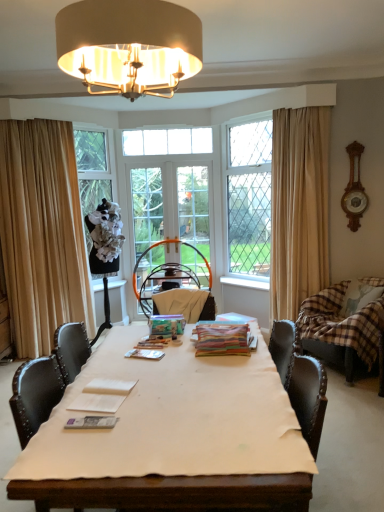
Question: Is there a large distance between metallic silver magazine at center, which is the second magazine from left to right, and clear glass window at center, the first window viewed from the right?

Choices:
 (A) yes
 (B) no

Answer: (A)

Question: Would you say metallic silver magazine at center, the second magazine from the bottom, contains clear glass window at center, acting as the 2th window starting from the left?

Choices:
 (A) no
 (B) yes

Answer: (A)

Question: Does metallic silver magazine at center, the 2th magazine when ordered from back to front, have a greater height compared to clear glass window at center, the 2th window positioned from the back?

Choices:
 (A) yes
 (B) no

Answer: (B)

Question: Is metallic silver magazine at center, the second magazine when ordered from right to left, touching clear glass window at center, the 2th window positioned from the back?

Choices:
 (A) yes
 (B) no

Answer: (B)

Question: Does metallic silver magazine at center, the second magazine when ordered from right to left, come behind clear glass window at center, which is counted as the first window, starting from the front?

Choices:
 (A) yes
 (B) no

Answer: (B)

Question: From the image's perspective, relative to brown plaid fabric swivel chair at right, is beige fabric curtain at left, acting as the first curtain starting from the left, above or below?

Choices:
 (A) below
 (B) above

Answer: (B)

Question: From a real-world perspective, is beige fabric curtain at left, acting as the first curtain starting from the left, physically located above or below brown plaid fabric swivel chair at right?

Choices:
 (A) above
 (B) below

Answer: (A)

Question: Is point (81, 309) positioned closer to the camera than point (339, 291)?

Choices:
 (A) closer
 (B) farther

Answer: (B)

Question: Based on their sizes in the image, would you say beige fabric curtain at left, acting as the first curtain starting from the left, is bigger or smaller than brown plaid fabric swivel chair at right?

Choices:
 (A) big
 (B) small

Answer: (A)

Question: Considering the positions of brown plaid fabric swivel chair at right and clear glass screen door at center, which ranks as the 1th screen door in right-to-left order, in the image, is brown plaid fabric swivel chair at right taller or shorter than clear glass screen door at center, which ranks as the 1th screen door in right-to-left order,?

Choices:
 (A) short
 (B) tall

Answer: (A)

Question: Considering the positions of brown plaid fabric swivel chair at right and clear glass screen door at center, positioned as the 2th screen door in left-to-right order, in the image, is brown plaid fabric swivel chair at right wider or thinner than clear glass screen door at center, positioned as the 2th screen door in left-to-right order,?

Choices:
 (A) wide
 (B) thin

Answer: (A)

Question: Is brown plaid fabric swivel chair at right situated inside clear glass screen door at center, positioned as the 2th screen door in left-to-right order, or outside?

Choices:
 (A) outside
 (B) inside

Answer: (A)

Question: Considering the positions of brown plaid fabric swivel chair at right and clear glass screen door at center, which ranks as the 1th screen door in right-to-left order, in the image, is brown plaid fabric swivel chair at right bigger or smaller than clear glass screen door at center, which ranks as the 1th screen door in right-to-left order,?

Choices:
 (A) small
 (B) big

Answer: (B)

Question: Is point (349, 295) closer or farther from the camera than point (188, 136)?

Choices:
 (A) closer
 (B) farther

Answer: (A)

Question: In terms of width, does plaid fabric pillow at right look wider or thinner when compared to clear glass window at upper center, which is the second window from right to left?

Choices:
 (A) wide
 (B) thin

Answer: (A)